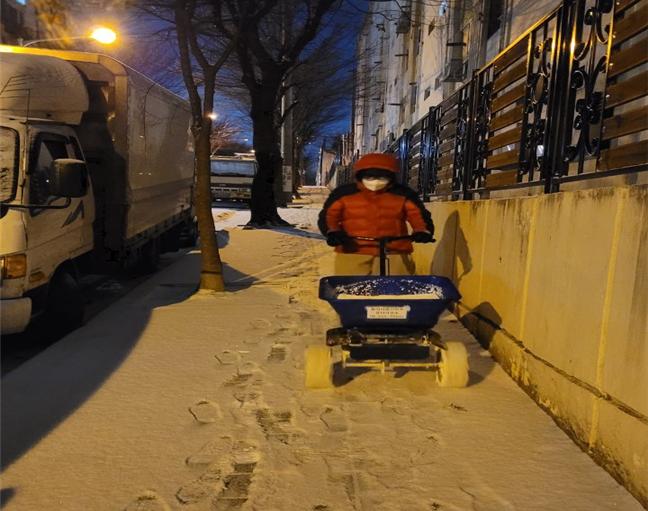
Find the location of a particular element. handle is located at coordinates (397, 241), (365, 239).